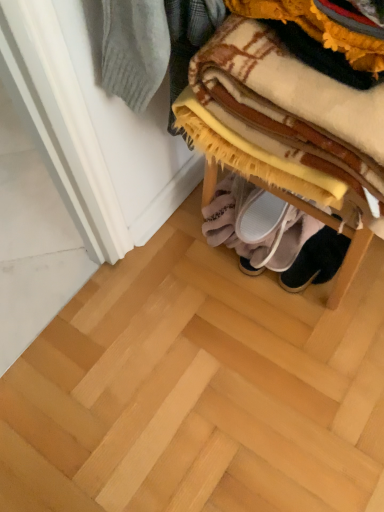
Where is `black suede shoes at lower center, placed as the second footwear when sorted from left to right`? black suede shoes at lower center, placed as the second footwear when sorted from left to right is located at coordinates (316, 260).

The height and width of the screenshot is (512, 384). Describe the element at coordinates (316, 260) in the screenshot. I see `black suede shoes at lower center, placed as the second footwear when sorted from left to right` at that location.

The width and height of the screenshot is (384, 512). Describe the element at coordinates (198, 389) in the screenshot. I see `wooden shoe rack at lower right` at that location.

The width and height of the screenshot is (384, 512). I want to click on black suede shoes at lower center, placed as the second footwear when sorted from left to right, so click(x=316, y=260).

Between black suede shoes at lower center, placed as the second footwear when sorted from left to right, and white fabric slipper at lower center, positioned as the 1th footwear in left-to-right order, which one has smaller size?

Smaller between the two is black suede shoes at lower center, placed as the second footwear when sorted from left to right.

Considering the points (323, 271) and (285, 251), which point is in front, point (323, 271) or point (285, 251)?

The point (285, 251) is in front.

Consider the image. Could you tell me if black suede shoes at lower center, placed as the second footwear when sorted from left to right, is facing white fabric slipper at lower center, which ranks as the second footwear in right-to-left order?

No, black suede shoes at lower center, placed as the second footwear when sorted from left to right, is not oriented towards white fabric slipper at lower center, which ranks as the second footwear in right-to-left order.

Is plaid fabric blanket at upper right located outside white fabric slipper at lower center, which ranks as the second footwear in right-to-left order?

Yes, plaid fabric blanket at upper right is located beyond the bounds of white fabric slipper at lower center, which ranks as the second footwear in right-to-left order.

From the image's perspective, which object appears higher, plaid fabric blanket at upper right or white fabric slipper at lower center, positioned as the 1th footwear in left-to-right order?

plaid fabric blanket at upper right appears higher in the image.

This screenshot has height=512, width=384. What are the coordinates of `furniture lying above the white fabric slipper at lower center, positioned as the 1th footwear in left-to-right order (from the image's perspective)` in the screenshot? It's located at (292, 106).

Looking at this image, is plaid fabric blanket at upper right facing towards white fabric slipper at lower center, positioned as the 1th footwear in left-to-right order?

No, plaid fabric blanket at upper right is not facing towards white fabric slipper at lower center, positioned as the 1th footwear in left-to-right order.

Considering the positions of points (348, 234) and (267, 453), is point (348, 234) farther from camera compared to point (267, 453)?

That is False.

In the image, is plaid fabric blanket at upper right positioned in front of or behind wooden shoe rack at lower right?

Clearly, plaid fabric blanket at upper right is in front of wooden shoe rack at lower right.

I want to click on stair located on the left of plaid fabric blanket at upper right, so click(x=198, y=389).

From the picture: Between plaid fabric blanket at upper right and wooden shoe rack at lower right, which one appears on the right side from the viewer's perspective?

plaid fabric blanket at upper right is more to the right.

From the picture: Is plaid fabric blanket at upper right behind black suede shoes at lower center, placed as the second footwear when sorted from left to right?

No, it is in front of black suede shoes at lower center, placed as the second footwear when sorted from left to right.

In the scene shown: What's the angular difference between plaid fabric blanket at upper right and black suede shoes at lower center, which ranks as the first footwear in right-to-left order,'s facing directions?

The angular difference between plaid fabric blanket at upper right and black suede shoes at lower center, which ranks as the first footwear in right-to-left order, is 89.2 degrees.

Can black suede shoes at lower center, placed as the second footwear when sorted from left to right, be found inside plaid fabric blanket at upper right?

Definitely not — black suede shoes at lower center, placed as the second footwear when sorted from left to right, is not inside plaid fabric blanket at upper right.

Is plaid fabric blanket at upper right facing towards black suede shoes at lower center, which ranks as the first footwear in right-to-left order?

No.

From the image's perspective, is black suede shoes at lower center, which ranks as the first footwear in right-to-left order, under plaid fabric blanket at upper right?

Yes, from the image's perspective, black suede shoes at lower center, which ranks as the first footwear in right-to-left order, is below plaid fabric blanket at upper right.

Considering the positions of point (295, 290) and point (363, 162), is point (295, 290) closer or farther from the camera than point (363, 162)?

Clearly, point (295, 290) is more distant from the camera than point (363, 162).

Who is bigger, black suede shoes at lower center, placed as the second footwear when sorted from left to right, or plaid fabric blanket at upper right?

plaid fabric blanket at upper right is bigger.

From a real-world perspective, is black suede shoes at lower center, which ranks as the first footwear in right-to-left order, positioned above or below plaid fabric blanket at upper right?

black suede shoes at lower center, which ranks as the first footwear in right-to-left order, is situated lower than plaid fabric blanket at upper right in the real world.

From the image's perspective, is white fabric slipper at lower center, positioned as the 1th footwear in left-to-right order, above or below plaid fabric blanket at upper right?

From the image's perspective, white fabric slipper at lower center, positioned as the 1th footwear in left-to-right order, appears below plaid fabric blanket at upper right.

Can you confirm if white fabric slipper at lower center, which ranks as the second footwear in right-to-left order, is thinner than plaid fabric blanket at upper right?

Correct, the width of white fabric slipper at lower center, which ranks as the second footwear in right-to-left order, is less than that of plaid fabric blanket at upper right.

Is white fabric slipper at lower center, which ranks as the second footwear in right-to-left order, to the left of plaid fabric blanket at upper right from the viewer's perspective?

Yes, white fabric slipper at lower center, which ranks as the second footwear in right-to-left order, is to the left of plaid fabric blanket at upper right.

Is point (303, 254) closer or farther from the camera than point (354, 254)?

Point (303, 254) appears to be farther away from the viewer than point (354, 254).

From the picture: From the image's perspective, is wooden shoe rack at lower right under plaid fabric blanket at upper right?

Yes.

How many degrees apart are the facing directions of wooden shoe rack at lower right and plaid fabric blanket at upper right?

wooden shoe rack at lower right and plaid fabric blanket at upper right are facing 179 degrees away from each other.

Is wooden shoe rack at lower right completely or partially outside of plaid fabric blanket at upper right?

Yes.

Image resolution: width=384 pixels, height=512 pixels. I want to click on footwear above the black suede shoes at lower center, placed as the second footwear when sorted from left to right (from a real-world perspective), so pyautogui.click(x=275, y=240).

The width and height of the screenshot is (384, 512). Find the location of `footwear that is the 1st object located below the plaid fabric blanket at upper right (from the image's perspective)`. footwear that is the 1st object located below the plaid fabric blanket at upper right (from the image's perspective) is located at coordinates (275, 240).

Looking at the image, which one is located further to plaid fabric blanket at upper right, black suede shoes at lower center, placed as the second footwear when sorted from left to right, or white fabric slipper at lower center, which ranks as the second footwear in right-to-left order?

Among the two, black suede shoes at lower center, placed as the second footwear when sorted from left to right, is located further to plaid fabric blanket at upper right.

Based on their spatial positions, is white fabric slipper at lower center, positioned as the 1th footwear in left-to-right order, or plaid fabric blanket at upper right closer to black suede shoes at lower center, placed as the second footwear when sorted from left to right?

white fabric slipper at lower center, positioned as the 1th footwear in left-to-right order.

Looking at the image, which one is located closer to wooden shoe rack at lower right, plaid fabric blanket at upper right or black suede shoes at lower center, which ranks as the first footwear in right-to-left order?

Based on the image, black suede shoes at lower center, which ranks as the first footwear in right-to-left order, appears to be nearer to wooden shoe rack at lower right.

Based on the photo, when comparing their distances from black suede shoes at lower center, placed as the second footwear when sorted from left to right, does wooden shoe rack at lower right or plaid fabric blanket at upper right seem closer?

Based on the image, wooden shoe rack at lower right appears to be nearer to black suede shoes at lower center, placed as the second footwear when sorted from left to right.

From the image, which object appears to be farther from plaid fabric blanket at upper right, wooden shoe rack at lower right or white fabric slipper at lower center, positioned as the 1th footwear in left-to-right order?

Based on the image, wooden shoe rack at lower right appears to be further to plaid fabric blanket at upper right.

Which object lies nearer to the anchor point black suede shoes at lower center, which ranks as the first footwear in right-to-left order, wooden shoe rack at lower right or white fabric slipper at lower center, positioned as the 1th footwear in left-to-right order?

white fabric slipper at lower center, positioned as the 1th footwear in left-to-right order, lies closer to black suede shoes at lower center, which ranks as the first footwear in right-to-left order, than the other object.

Based on their spatial positions, is plaid fabric blanket at upper right or white fabric slipper at lower center, which ranks as the second footwear in right-to-left order, further from black suede shoes at lower center, which ranks as the first footwear in right-to-left order?

plaid fabric blanket at upper right is positioned further to the anchor black suede shoes at lower center, which ranks as the first footwear in right-to-left order.

Looking at the image, which one is located further to white fabric slipper at lower center, positioned as the 1th footwear in left-to-right order, wooden shoe rack at lower right or plaid fabric blanket at upper right?

plaid fabric blanket at upper right is further to white fabric slipper at lower center, positioned as the 1th footwear in left-to-right order.

Image resolution: width=384 pixels, height=512 pixels. I want to click on footwear positioned between wooden shoe rack at lower right and black suede shoes at lower center, which ranks as the first footwear in right-to-left order, from near to far, so click(x=275, y=240).

Where is `footwear positioned between plaid fabric blanket at upper right and black suede shoes at lower center, which ranks as the first footwear in right-to-left order, from near to far`? footwear positioned between plaid fabric blanket at upper right and black suede shoes at lower center, which ranks as the first footwear in right-to-left order, from near to far is located at coordinates (275, 240).